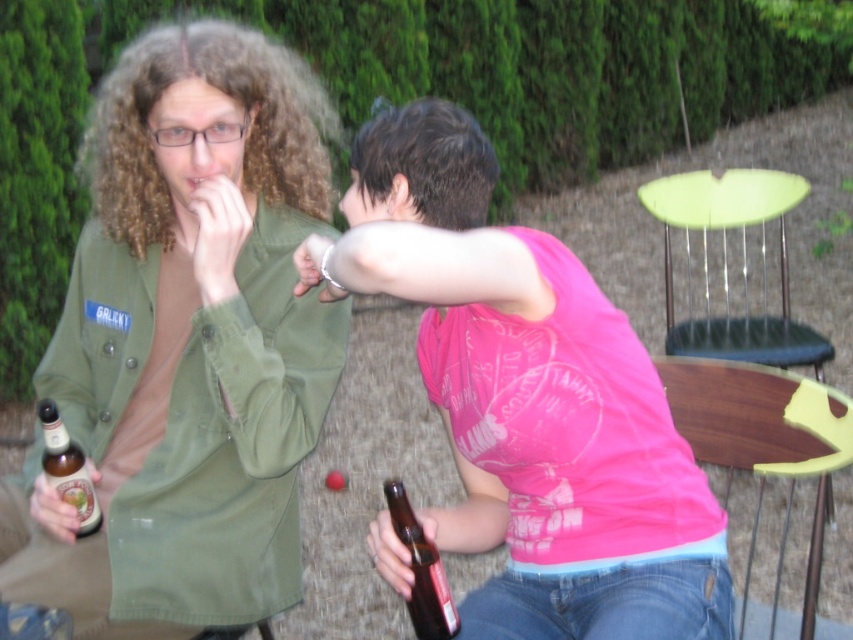
You are a photographer trying to capture a candid shot of the two people in the scene. You want to ensure that both the pink cotton shirt at center and the brown glass bottle at lower left are in focus. Given that your camera has a depth of field that can cover objects within a 25 inch range, will you be able to achieve this?

The pink cotton shirt at center and the brown glass bottle at lower left are 26.18 inches apart from each other. Since the distance exceeds the camera depth of field range of 25 inches, it will be difficult to keep both in focus simultaneously.

You are a photographer trying to capture the pink fabric tank top at upper right in the image. According to the coordinates provided, where exactly should you aim your camera?

The pink fabric tank top at upper right is located at coordinates point (186, 344).

You are organizing a clothing donation drive and need to categorize items by size. You have two pink tops to sort. The pink fabric tank top at upper right and the pink cotton shirt at center. Which one should you place in the large size bin?

The pink fabric tank top at upper right is bigger than the pink cotton shirt at center, so it should be placed in the large size bin.